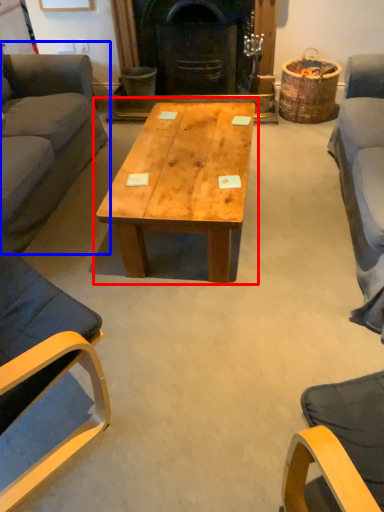
Question: Which of the following is the farthest to the observer, coffee table (highlighted by a red box) or studio couch (highlighted by a blue box)?

Choices:
 (A) coffee table
 (B) studio couch

Answer: (A)